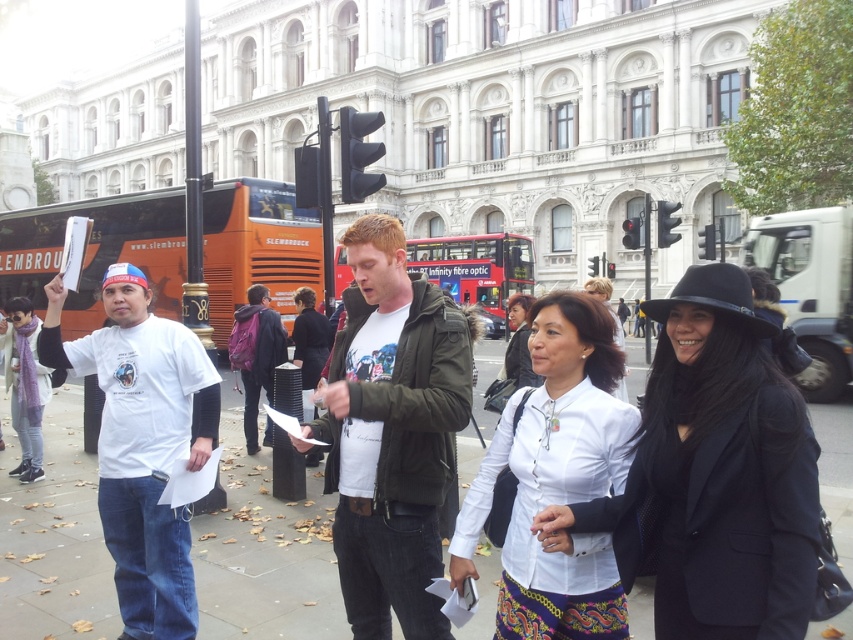
You are a pedestrian standing on the brown concrete pavement at lower center. You want to reach the green cotton jacket at center to ask a question. Is the jacket above or below you?

The brown concrete pavement at lower center is positioned under green cotton jacket at center, so the jacket is above you.